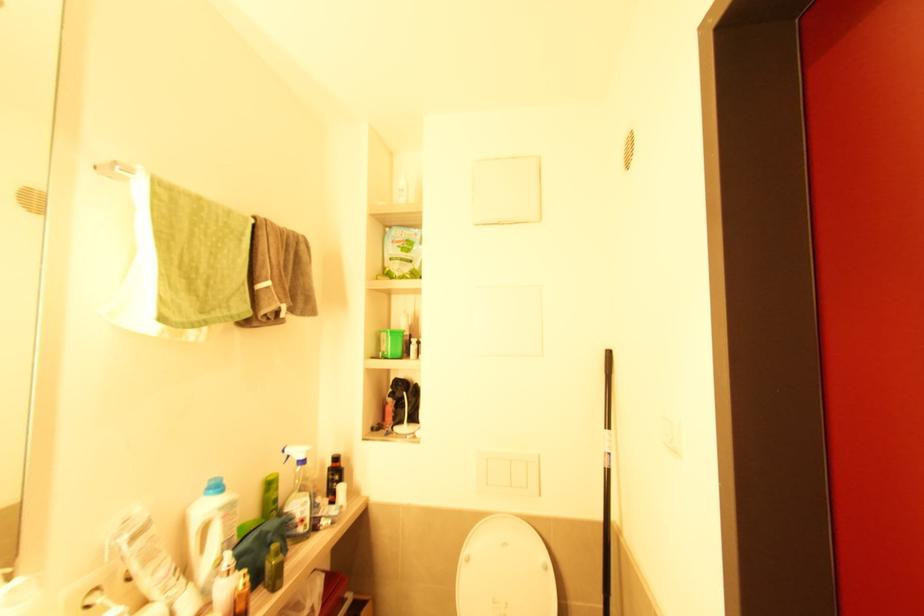
Find where to push the toilet flush button. Please return your answer as a coordinate pair (x, y).

(507, 472)